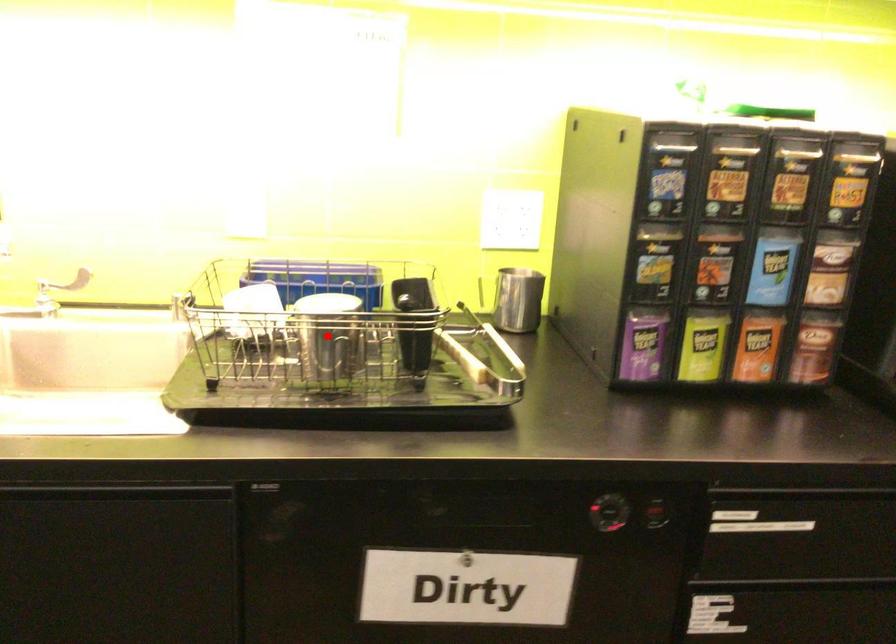
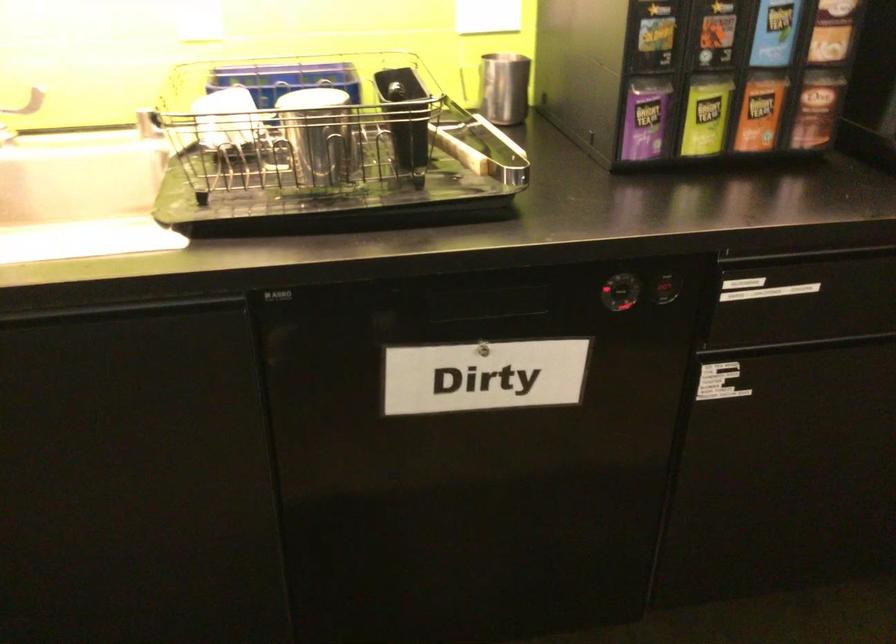
Locate, in the second image, the point that corresponds to the highlighted location in the first image.

(319, 134)